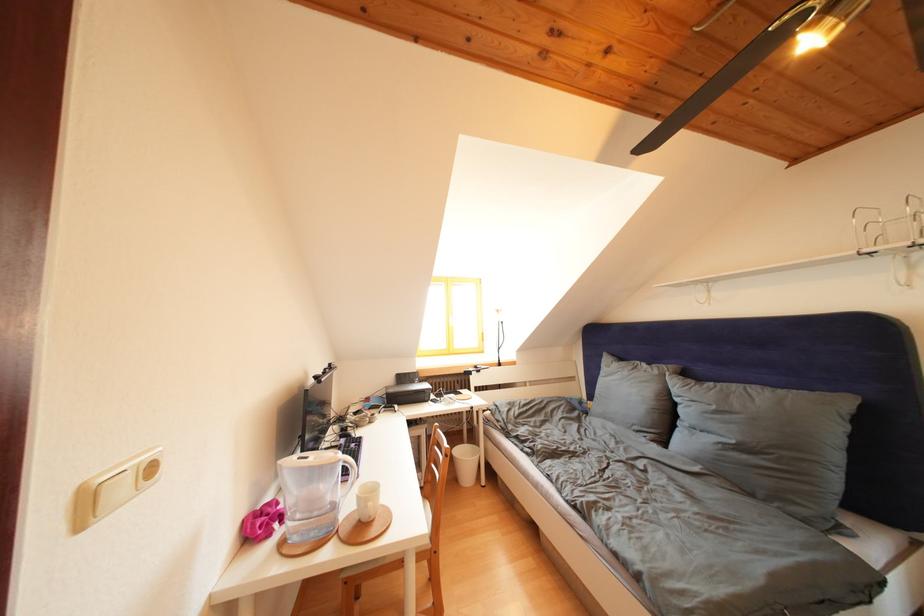
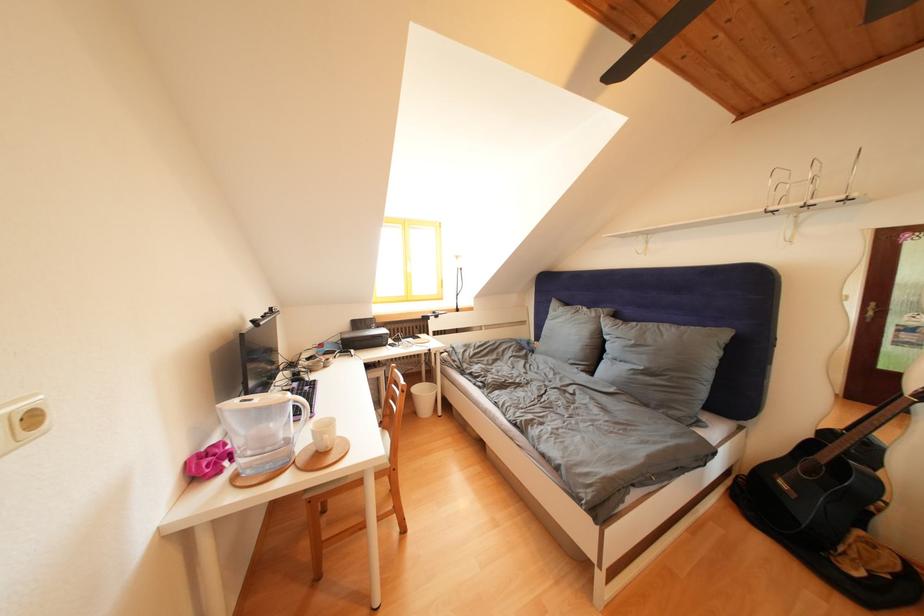
Where in the second image is the point corresponding to pixel 360 450 from the first image?

(314, 392)